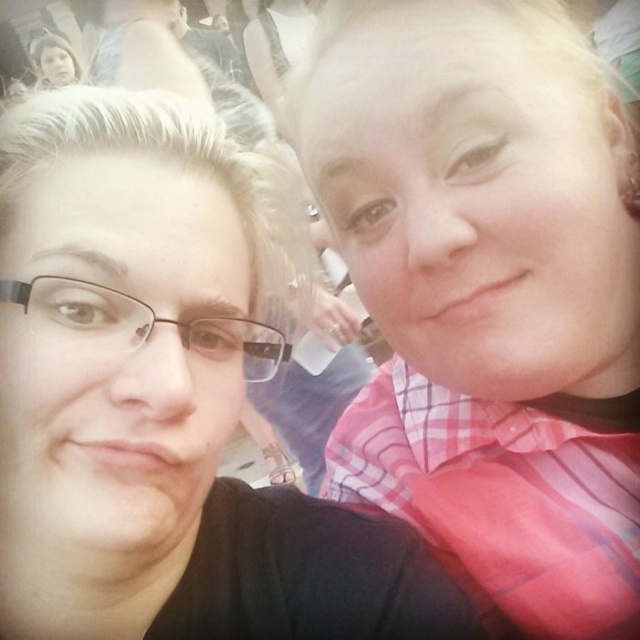
Question: Does pink checkered shirt at center appear on the right side of black plastic glasses at left?

Choices:
 (A) yes
 (B) no

Answer: (A)

Question: Considering the real-world distances, which object is farthest from the black plastic glasses at left?

Choices:
 (A) pink checkered shirt at center
 (B) pink checkered shirt at upper right

Answer: (A)

Question: In this image, where is pink checkered shirt at center located relative to black plastic glasses at left?

Choices:
 (A) above
 (B) below

Answer: (B)

Question: Which object is closer to the camera taking this photo?

Choices:
 (A) pink checkered shirt at center
 (B) pink checkered shirt at upper right

Answer: (B)

Question: Which point is farther to the camera?

Choices:
 (A) pink checkered shirt at center
 (B) black plastic glasses at left
 (C) pink checkered shirt at upper right

Answer: (A)

Question: Is the position of pink checkered shirt at center less distant than that of black plastic glasses at left?

Choices:
 (A) no
 (B) yes

Answer: (A)